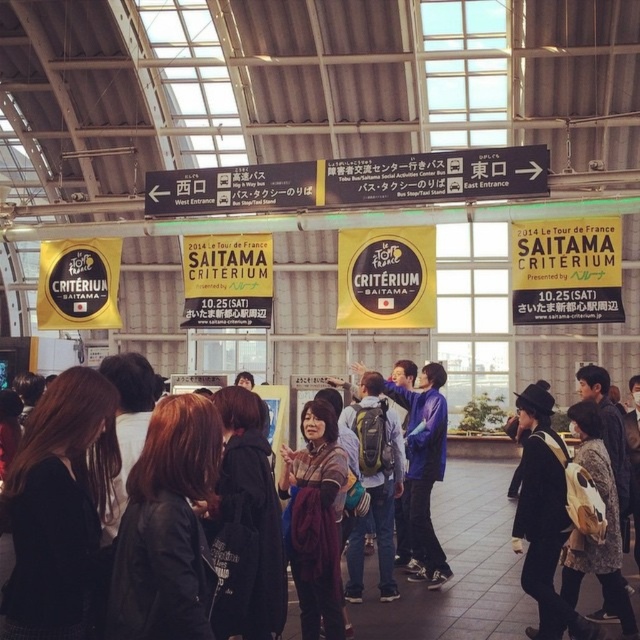
You are a traveler who wants to place both the maroon fabric scarf at center and the matte black backpack at center into a bag that can only hold items smaller than the backpack. Which item can you put in the bag?

The maroon fabric scarf at center is smaller than the matte black backpack at center, so you can put the maroon fabric scarf at center into the bag.

You are a photographer standing in the train station and want to capture both the dark brown leather jacket at lower left and the matte black backpack at center in a single frame. Which object should you focus on first to ensure both are in the shot?

You should focus on the matte black backpack at center first because it is larger than the dark brown leather jacket at lower left, ensuring it fits within the frame while the smaller jacket remains visible.